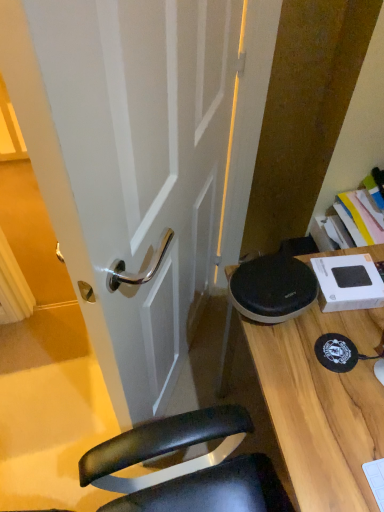
Image resolution: width=384 pixels, height=512 pixels. What do you see at coordinates (137, 169) in the screenshot?
I see `white glossy door handle at center` at bounding box center [137, 169].

I want to click on white glossy door handle at center, so click(x=137, y=169).

At what (x,y) coordinates should I click in order to perform the action: click on white glossy door handle at center. Please return your answer as a coordinate pair (x, y). Image resolution: width=384 pixels, height=512 pixels. Looking at the image, I should click on (137, 169).